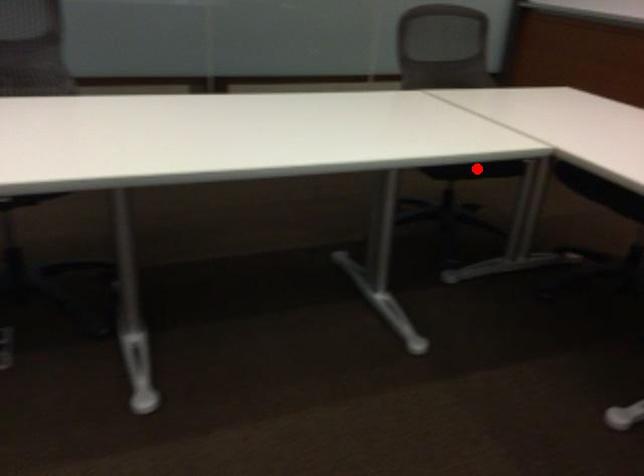
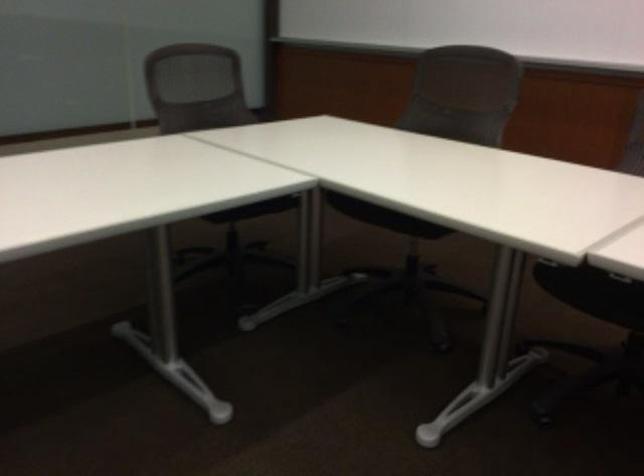
Where in the second image is the point corresponding to the highlighted location from the first image?

(254, 209)